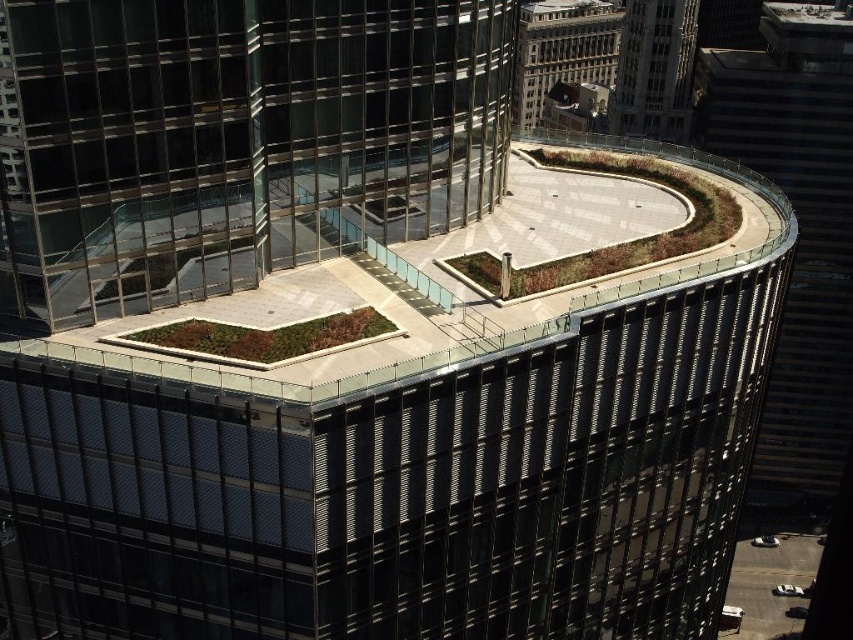
You are a drone operator tasked with flying a drone from the transparent glass building at upper center to the metallic glass tower at right. Given the spatial arrangement, can you safely navigate the drone between these two structures without any obstacles?

The transparent glass building at upper center is positioned under the metallic glass tower at right, so the drone can safely navigate between them as there is no obstruction between their positions.

You are a drone operator tasked with flying a drone between the transparent glass building at upper center and the matte glass tower at upper center. The drone has a minimum required distance of 80 meters to safely navigate between structures. Can the drone safely fly between these two buildings?

The transparent glass building at upper center is 82.79 meters from the matte glass tower at upper center. Since the distance between them is greater than the drone operator requires, the drone can safely navigate between the two structures.